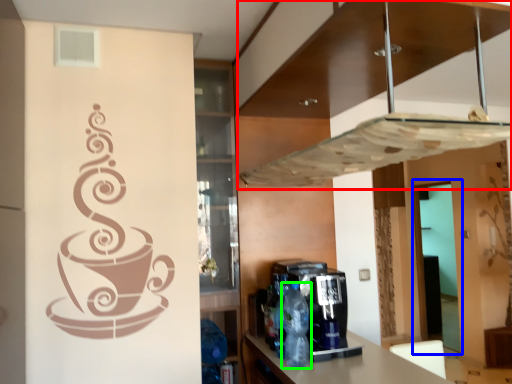
Question: Considering the real-world distances, which object is closest to exhaust hood (highlighted by a red box)? glass door (highlighted by a blue box) or bottle (highlighted by a green box).

Choices:
 (A) glass door
 (B) bottle

Answer: (B)